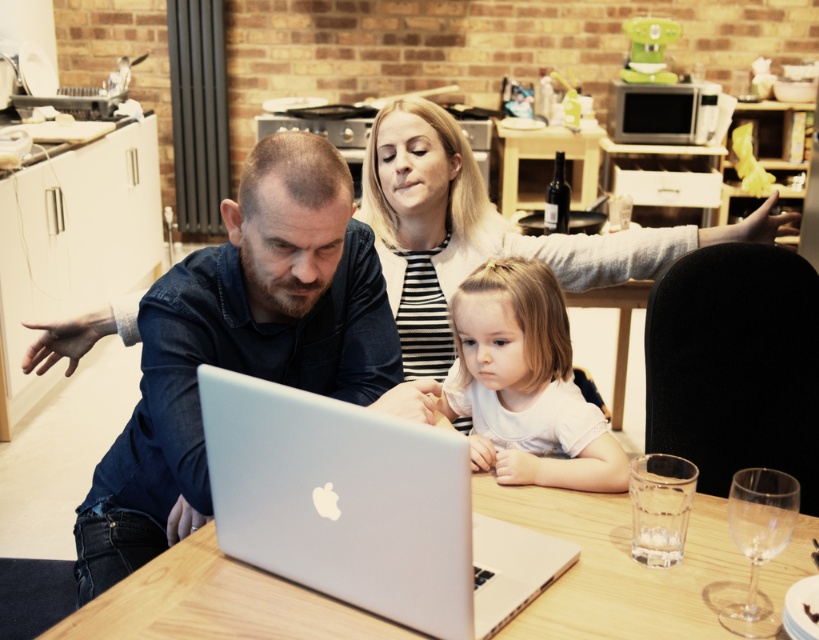
Question: Is the position of matte blue shirt at center less distant than that of wooden table at center?

Choices:
 (A) yes
 (B) no

Answer: (B)

Question: Which object is farther from the camera taking this photo?

Choices:
 (A) wooden table at center
 (B) matte blue shirt at center
 (C) white striped shirt at upper center

Answer: (C)

Question: Does matte blue shirt at center have a larger size compared to white matte shirt at center?

Choices:
 (A) yes
 (B) no

Answer: (A)

Question: Estimate the real-world distances between objects in this image. Which object is closer to the silver metallic laptop at center?

Choices:
 (A) wooden table at center
 (B) white striped shirt at upper center
 (C) matte blue shirt at center
 (D) white matte shirt at center

Answer: (A)

Question: Can you confirm if silver metallic laptop at center is positioned to the right of white striped shirt at upper center?

Choices:
 (A) no
 (B) yes

Answer: (A)

Question: Among these points, which one is nearest to the camera?

Choices:
 (A) (245, 300)
 (B) (582, 250)

Answer: (A)